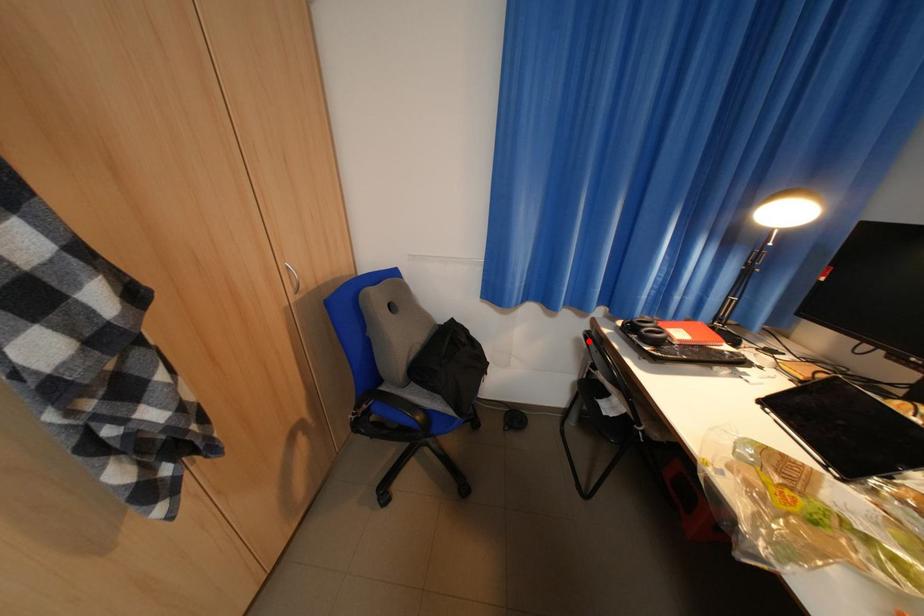
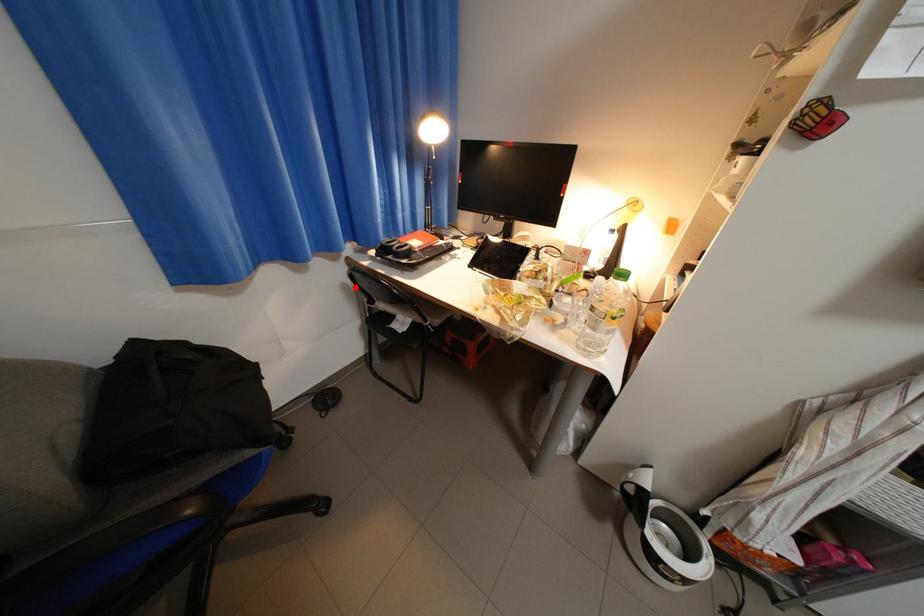
I am providing you with two images of the same scene from different viewpoints. A red point is marked on the first image and another point is marked on the second image. Is the red point in image1 aligned with the point shown in image2?

Yes